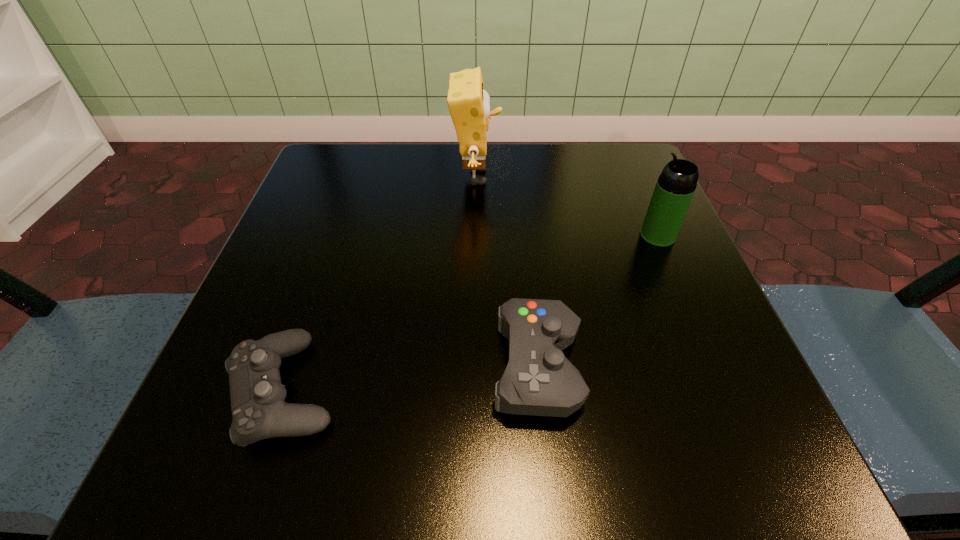
I want to click on unoccupied area between the leftmost object and the third nearest object, so click(471, 313).

Locate an element on the screen. free space between the tallest object and the left control is located at coordinates (380, 283).

Where is `object that is the closest one to the sponge`? The height and width of the screenshot is (540, 960). object that is the closest one to the sponge is located at coordinates (676, 185).

Locate which object ranks in proximity to the left control. Please provide its 2D coordinates. Your answer should be formatted as a tuple, i.e. [(x, y)], where the tuple contains the x and y coordinates of a point satisfying the conditions above.

[(539, 380)]

This screenshot has width=960, height=540. Find the location of `free region that satisfies the following two spatial constraints: 1. on the face of the tallest object; 2. on the back side of the right control`. free region that satisfies the following two spatial constraints: 1. on the face of the tallest object; 2. on the back side of the right control is located at coordinates (474, 367).

Where is `free region that satisfies the following two spatial constraints: 1. on the face of the right control; 2. on the right side of the tallest object`? This screenshot has width=960, height=540. free region that satisfies the following two spatial constraints: 1. on the face of the right control; 2. on the right side of the tallest object is located at coordinates (474, 367).

You are a GUI agent. You are given a task and a screenshot of the screen. Output one action in this format:
    pyautogui.click(x=<x>, y=<y>)
    Task: Click on the free location that satisfies the following two spatial constraints: 1. from the spout of the third nearest object; 2. on the front side of the right control
    Image resolution: width=960 pixels, height=540 pixels.
    Given the screenshot: What is the action you would take?
    pyautogui.click(x=713, y=367)